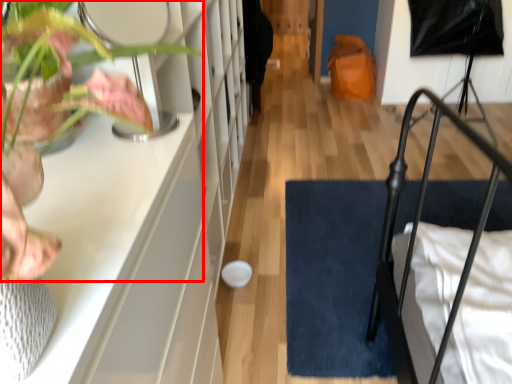
Question: From the image's perspective, where is houseplant (annotated by the red box) located in relation to doormat in the image?

Choices:
 (A) above
 (B) below

Answer: (A)